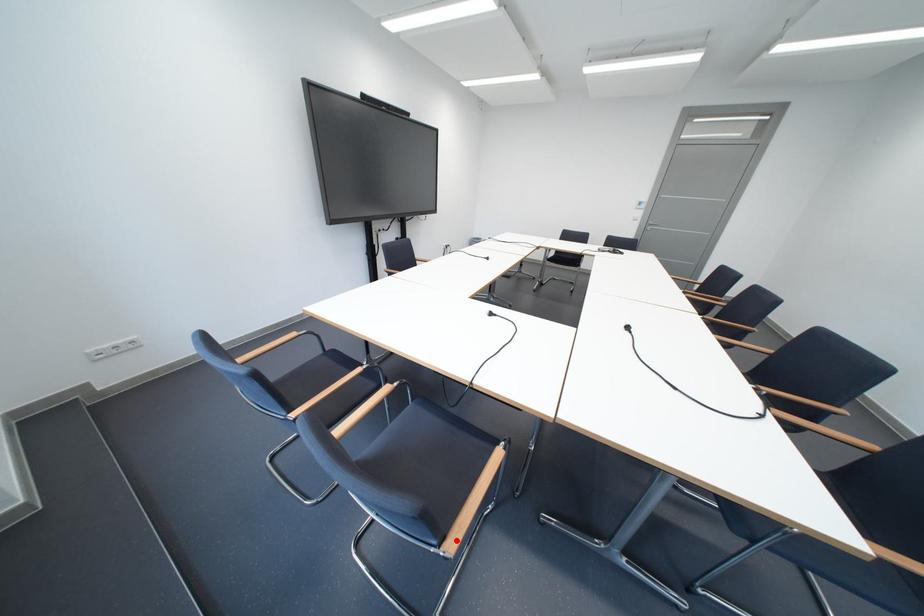
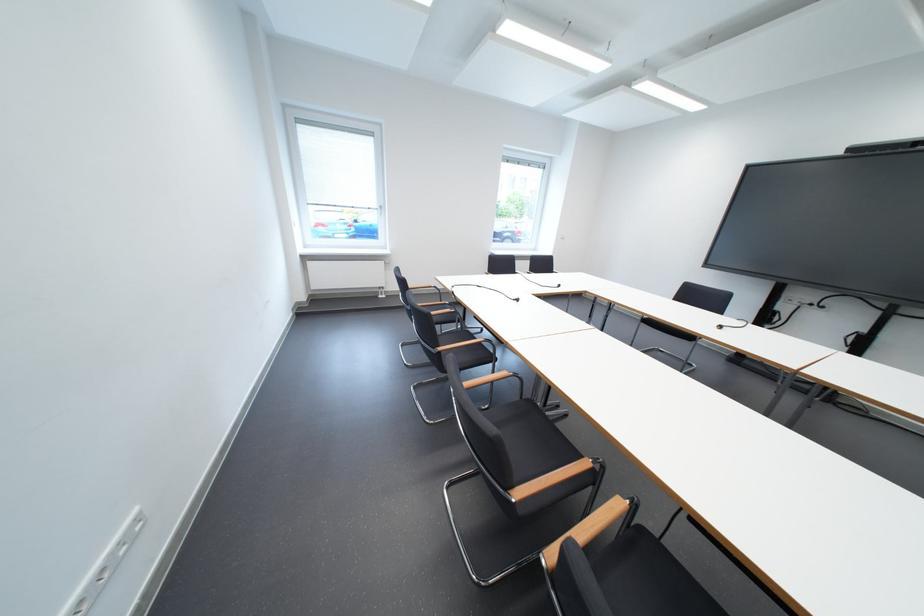
Question: I am providing you with two images of the same scene from different viewpoints. A red point is marked on the first image. At the location where the point appears in image 1, is it still visible in image 2?

Choices:
 (A) Yes
 (B) No

Answer: (B)